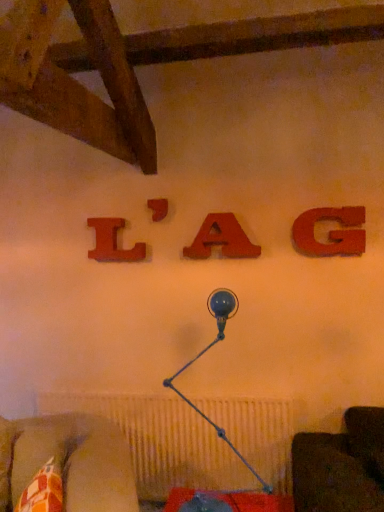
Question: Is wooden letter l at upper center, which appears as the fourth alphabet when viewed from the right, situated inside matte wood letter at center, which ranks as the 2th alphabet in left-to-right order, or outside?

Choices:
 (A) inside
 (B) outside

Answer: (B)

Question: Considering the positions of wooden letter l at upper center, the 1th alphabet viewed from the left, and matte wood letter at center, which ranks as the 2th alphabet in left-to-right order, in the image, is wooden letter l at upper center, the 1th alphabet viewed from the left, taller or shorter than matte wood letter at center, which ranks as the 2th alphabet in left-to-right order,?

Choices:
 (A) short
 (B) tall

Answer: (B)

Question: Estimate the real-world distances between objects in this image. Which object is closer to the matte wood letter at center, which ranks as the 2th alphabet in left-to-right order?

Choices:
 (A) matte wood letter a at center, positioned as the 3th alphabet in left-to-right order
 (B) patterned fabric cushion at lower left
 (C) wooden letter l at upper center, which appears as the fourth alphabet when viewed from the right
 (D) matte wood g at upper right, positioned as the fourth alphabet in left-to-right order
 (E) blue glass table lamp at center

Answer: (C)

Question: Estimate the real-world distances between objects in this image. Which object is closer to the matte wood letter at center, which is the 3th alphabet in right-to-left order?

Choices:
 (A) wooden letter l at upper center, the 1th alphabet viewed from the left
 (B) matte wood g at upper right, positioned as the fourth alphabet in left-to-right order
 (C) matte wood letter a at center, placed as the second alphabet when sorted from right to left
 (D) blue glass table lamp at center
 (E) patterned fabric cushion at lower left

Answer: (A)